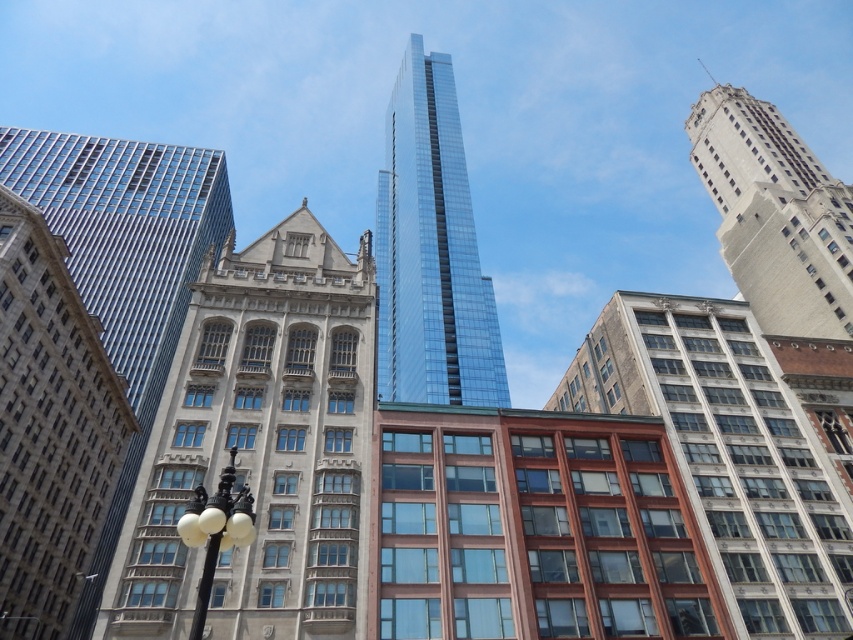
You are an urban planner assessing the city layout. You need to determine which of the two buildings, the stone textured building at center or the shiny glass skyscraper at center, has a wider footprint. Based on the scene, can you determine this?

The stone textured building at center has a lesser width compared to the shiny glass skyscraper at center, so the shiny glass skyscraper at center has a wider footprint.

What is located at the coordinates point (740, 445)?

At point (740, 445) lies brown brick building at center.

You are standing at a viewpoint overlooking the cityscape. You see two points marked in the image. The first point is at coordinates point (x=154, y=596) and the second is at point (x=450, y=289). Which point is closer to you?

Point (x=154, y=596) is in front of point (x=450, y=289), so it is closer to you.